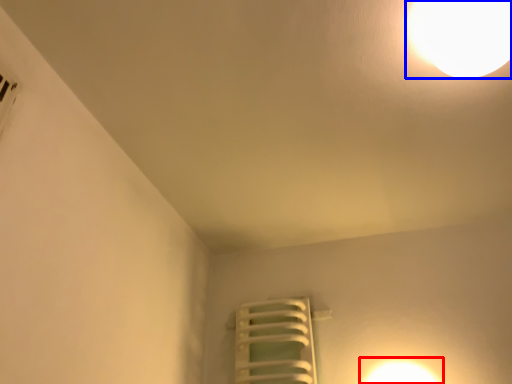
Question: Which of the following is the closest to the observer, light (highlighted by a red box) or lamp (highlighted by a blue box)?

Choices:
 (A) light
 (B) lamp

Answer: (B)